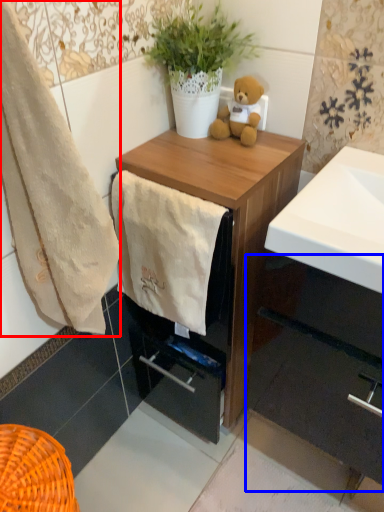
Question: Which of the following is the farthest to the observer, towel/napkin (highlighted by a red box) or cabinetry (highlighted by a blue box)?

Choices:
 (A) towel/napkin
 (B) cabinetry

Answer: (B)